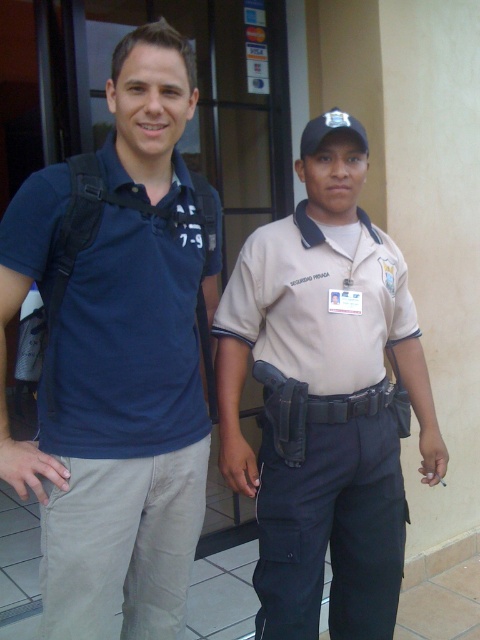
Is matte blue shirt at left to the left of tan fabric shirt at center from the viewer's perspective?

Indeed, matte blue shirt at left is positioned on the left side of tan fabric shirt at center.

Is matte blue shirt at left closer to camera compared to tan fabric shirt at center?

Yes.

Between point (212, 253) and point (387, 241), which one is positioned behind?

Positioned behind is point (387, 241).

Image resolution: width=480 pixels, height=640 pixels. I want to click on matte blue shirt at left, so click(126, 433).